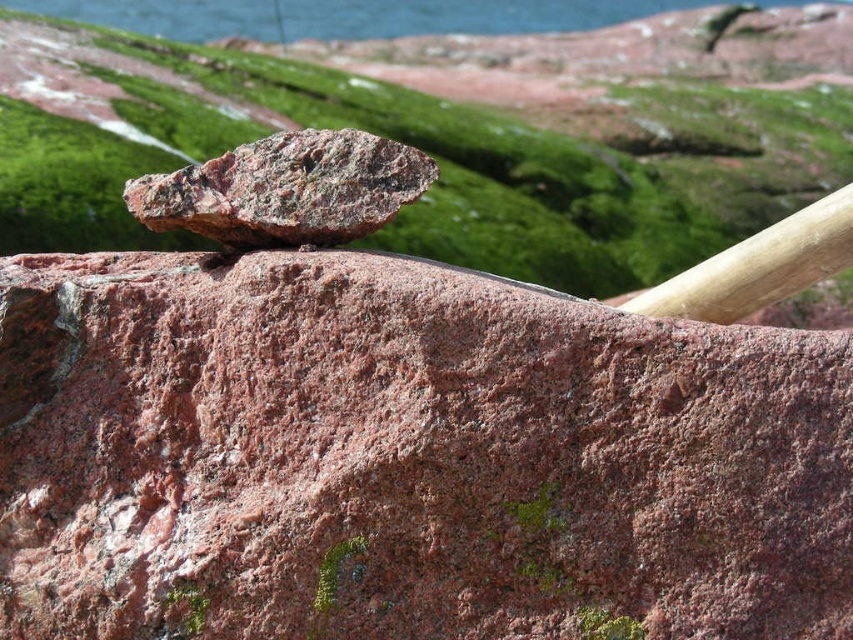
Question: Which object is closer to the camera taking this photo?

Choices:
 (A) rusty granite rock at center
 (B) blue water at upper center

Answer: (A)

Question: Is rusty granite rock at center further to camera compared to blue water at upper center?

Choices:
 (A) no
 (B) yes

Answer: (A)

Question: Does rusty granite rock at center have a lesser width compared to blue water at upper center?

Choices:
 (A) no
 (B) yes

Answer: (B)

Question: Which of these objects is positioned closest to the blue water at upper center?

Choices:
 (A) rusty metallic rock at center
 (B) rusty granite rock at center

Answer: (A)

Question: Which point is farther to the camera?

Choices:
 (A) (488, 412)
 (B) (225, 228)

Answer: (B)

Question: Observing the image, what is the correct spatial positioning of rusty granite rock at center in reference to rusty metallic rock at center?

Choices:
 (A) above
 (B) below

Answer: (B)